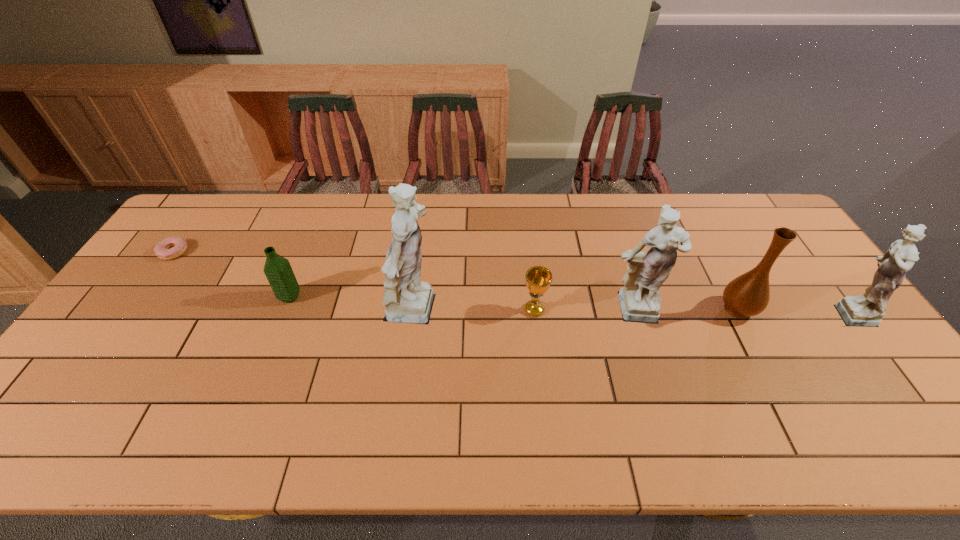
Given the evenly spaced figurines in the image, where should an extra figurine be added on the left to preserve the spacing? Please point to a vacant space. Please provide its 2D coordinates. Your answer should be formatted as a tuple, i.e. [(x, y)], where the tuple contains the x and y coordinates of a point satisfying the conditions above.

[(201, 315)]